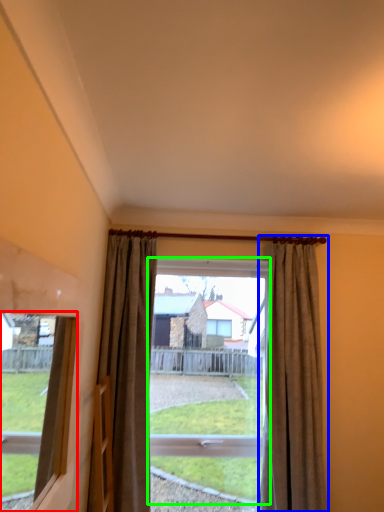
Question: Which is farther away from window (highlighted by a red box)? curtain (highlighted by a blue box) or bay window (highlighted by a green box)?

Choices:
 (A) curtain
 (B) bay window

Answer: (A)